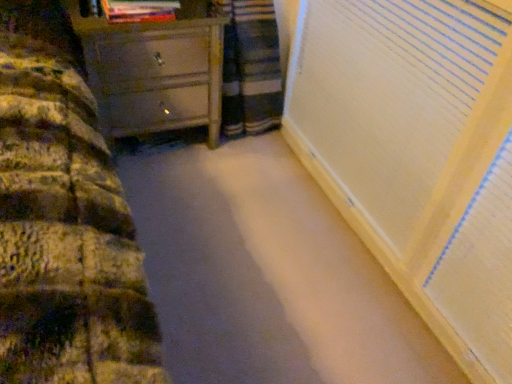
Measure the distance between matte gray chest of drawers at center and camera.

The depth of matte gray chest of drawers at center is 1.45 meters.

Image resolution: width=512 pixels, height=384 pixels. What do you see at coordinates (154, 73) in the screenshot? I see `matte gray chest of drawers at center` at bounding box center [154, 73].

In order to click on matte gray chest of drawers at center in this screenshot , I will do `click(154, 73)`.

Locate an element on the screen. matte gray chest of drawers at center is located at coordinates (154, 73).